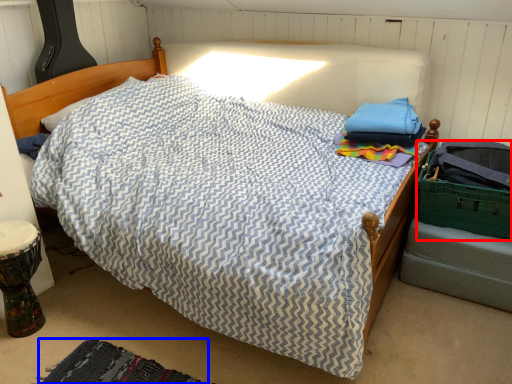
Question: Which object is further to the camera taking this photo, laundry basket (highlighted by a red box) or mat (highlighted by a blue box)?

Choices:
 (A) laundry basket
 (B) mat

Answer: (A)